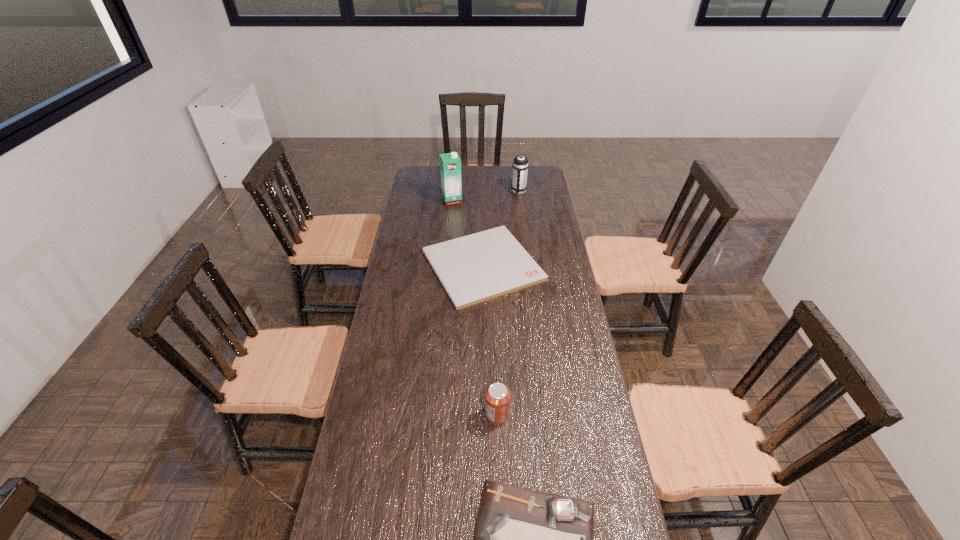
Find the location of `vacant space that is in between the thermos bottle and the tallest object`. vacant space that is in between the thermos bottle and the tallest object is located at coordinates (486, 196).

Where is `free space between the thermos bottle and the carton`? The height and width of the screenshot is (540, 960). free space between the thermos bottle and the carton is located at coordinates (486, 196).

The image size is (960, 540). Find the location of `object that stands as the second closest to the nearer clipboard`. object that stands as the second closest to the nearer clipboard is located at coordinates coord(475,268).

Locate which object ranks fourth in proximity to the carton. Please provide its 2D coordinates. Your answer should be formatted as a tuple, i.e. [(x, y)], where the tuple contains the x and y coordinates of a point satisfying the conditions above.

[(524, 539)]

You are a GUI agent. You are given a task and a screenshot of the screen. Output one action in this format:
    pyautogui.click(x=<x>, y=<y>)
    Task: Click on the vacant space that satisfies the following two spatial constraints: 1. on the front side of the farther clipboard; 2. on the left side of the tallest object
    
    Given the screenshot: What is the action you would take?
    pyautogui.click(x=446, y=265)